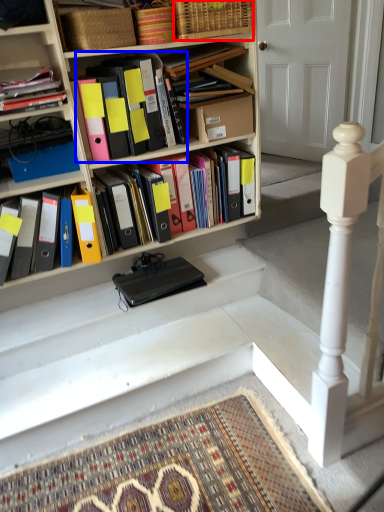
Question: Which object is closer to the camera taking this photo, basket (highlighted by a red box) or book (highlighted by a blue box)?

Choices:
 (A) basket
 (B) book

Answer: (B)